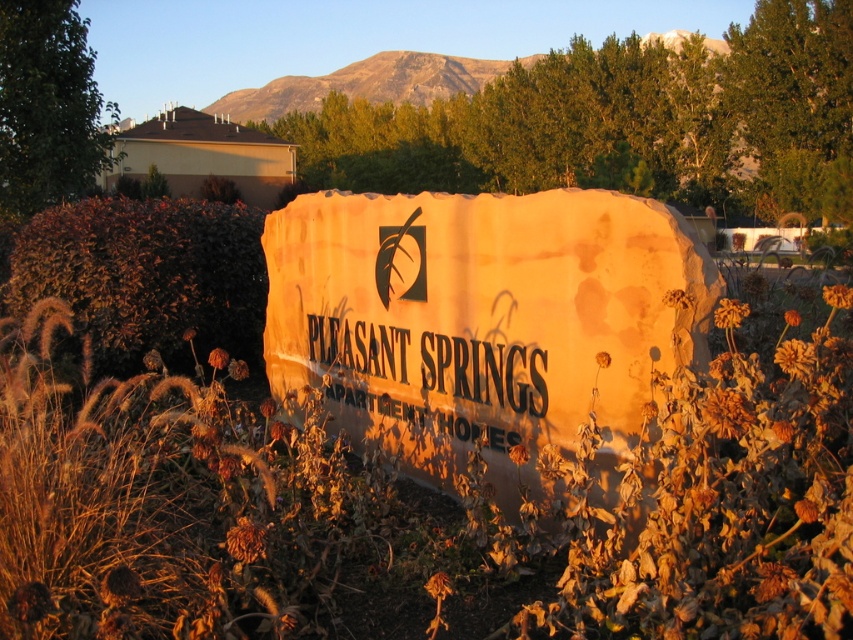
You are standing in front of the Pleasant Springs Apartment Homes sign and notice a brown dried flower at center and a matte stone sign at center. Which object is positioned lower in the scene?

The brown dried flower at center is located below the matte stone sign at center, so it is positioned lower in the scene.

You are standing in front of the Pleasant Springs Apartment Homes sign. There are two signs here, a matte stone sign at center and a black stone sign at center. Which one do you see first when looking at them?

The matte stone sign at center is closer to the viewer than the black stone sign at center, so you would see the matte stone sign at center first.